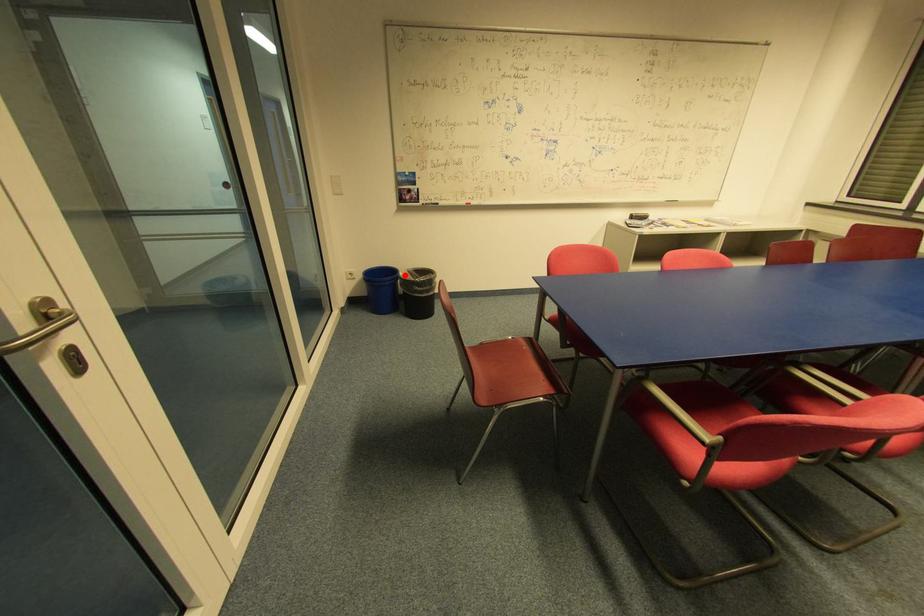
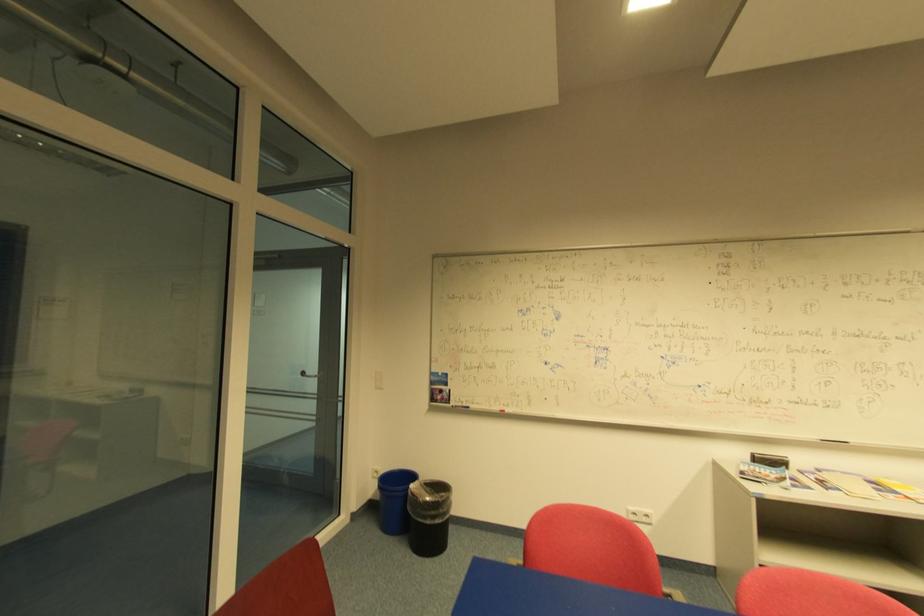
Question: A red point is marked in image1. In image2, is the corresponding 3D point closer to the camera or farther? Reply with the corresponding letter.

Choices:
 (A) The corresponding 3D point is closer.
 (B) The corresponding 3D point is farther.

Answer: (B)